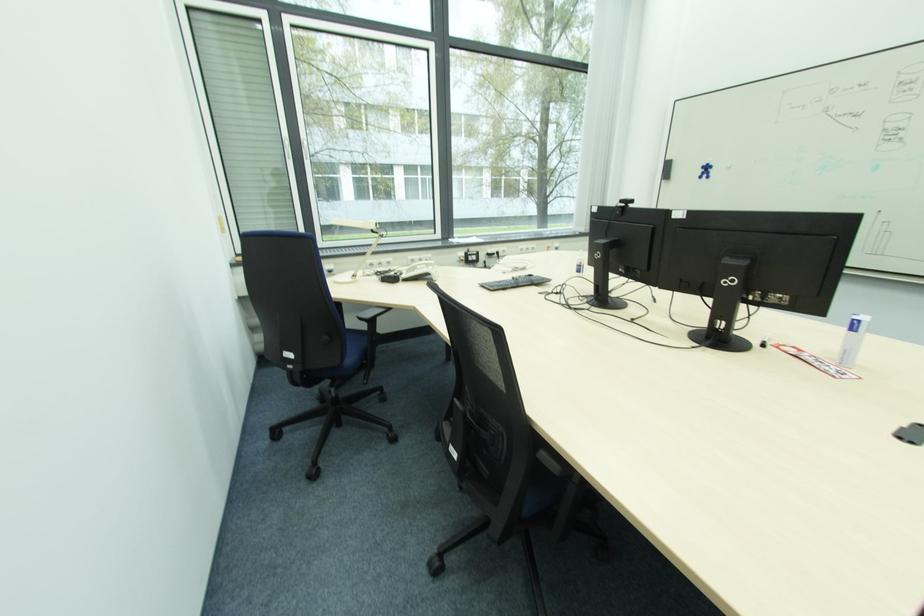
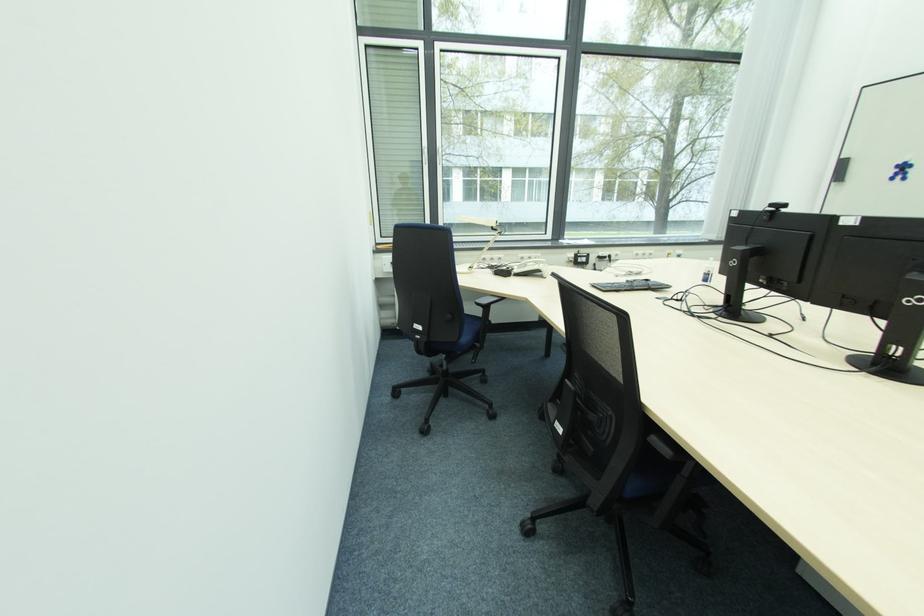
Where in the second image is the point corresponding to the point at 385,313 from the first image?

(500, 301)